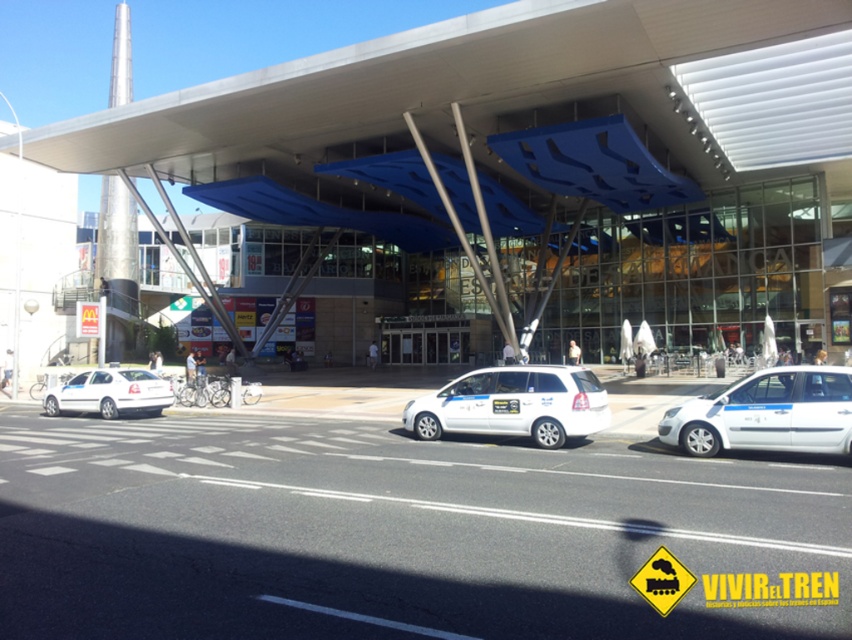
Is transparent glass building at center below white matte van at center?

No.

Can you confirm if transparent glass building at center is bigger than white matte van at center?

Indeed, transparent glass building at center has a larger size compared to white matte van at center.

Describe the element at coordinates (517, 179) in the screenshot. This screenshot has height=640, width=852. I see `transparent glass building at center` at that location.

Where is `transparent glass building at center`? The image size is (852, 640). transparent glass building at center is located at coordinates (517, 179).

Consider the image. Who is lower down, transparent glass building at center or white matte van at right?

white matte van at right

Which is in front, point (188, 104) or point (813, 444)?

Point (813, 444) is more forward.

Find the location of a particular element. This screenshot has width=852, height=640. transparent glass building at center is located at coordinates (517, 179).

Is transparent glass building at center thinner than white matte van at left?

Incorrect, transparent glass building at center's width is not less than white matte van at left's.

Between transparent glass building at center and white matte van at left, which one is positioned higher?

transparent glass building at center

At what (x,y) coordinates should I click in order to perform the action: click on transparent glass building at center. Please return your answer as a coordinate pair (x, y). Looking at the image, I should click on (517, 179).